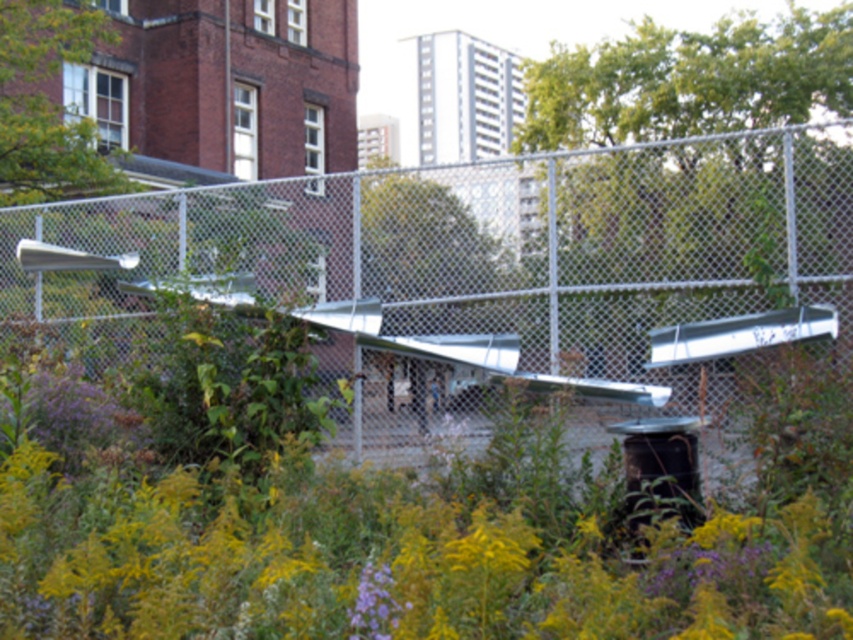
Which is above, silver chain-link fence at center or purple matte flower at center?

silver chain-link fence at center is above.

Between point (167, 234) and point (370, 564), which one is positioned in front?

Positioned in front is point (370, 564).

The width and height of the screenshot is (853, 640). In order to click on silver chain-link fence at center in this screenshot , I will do `click(485, 259)`.